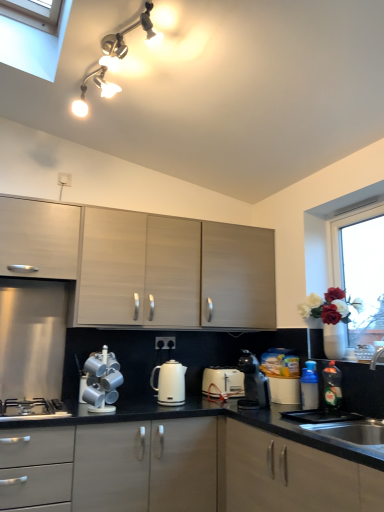
Where is `blank space situated above white plastic toaster at center, which appears as the 1th appliance when viewed from the back (from a real-world perspective)`? The image size is (384, 512). blank space situated above white plastic toaster at center, which appears as the 1th appliance when viewed from the back (from a real-world perspective) is located at coordinates (226, 369).